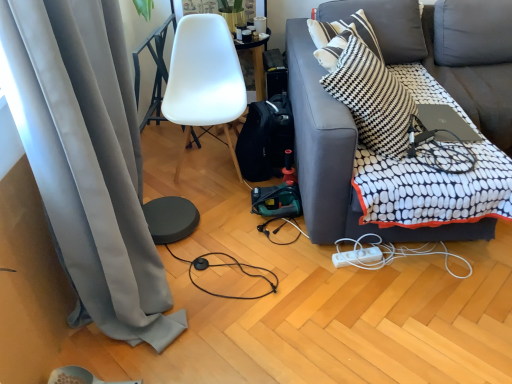
This screenshot has height=384, width=512. I want to click on free space in front of black cable at lower center, so click(x=234, y=340).